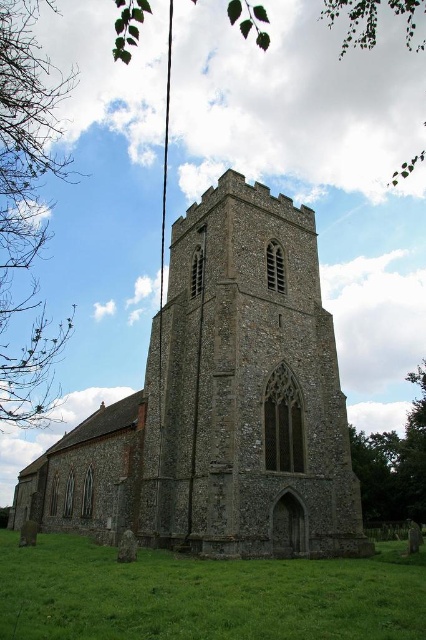
You are standing at the base of the stone church at center and want to place a small garden of green grass at lower center. Considering their heights, which one is taller?

The stone church at center is taller than the green grass at lower center according to the description.

You are standing at the edge of the green grass at lower center and want to walk towards the stone church at center. In which direction should you head?

You should head to the right because the stone church at center is located to the left of green grass at lower center, so moving right from the grass will lead you toward the church.